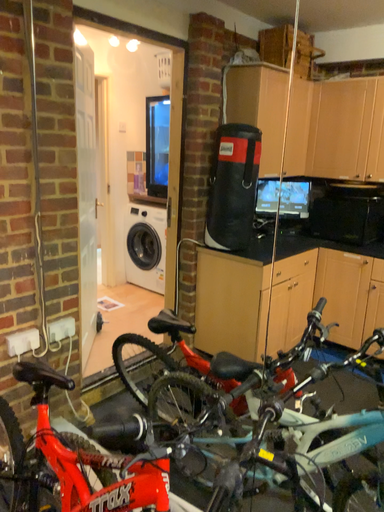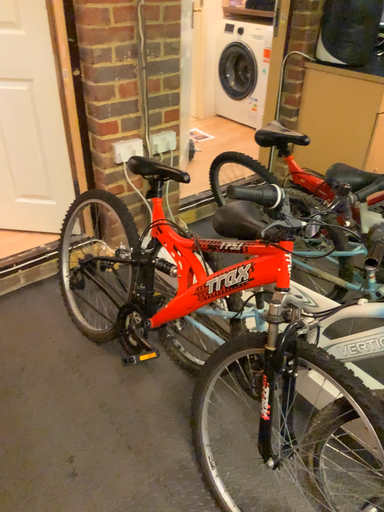
Question: How did the camera likely rotate when shooting the video?

Choices:
 (A) rotated upward
 (B) rotated downward

Answer: (B)